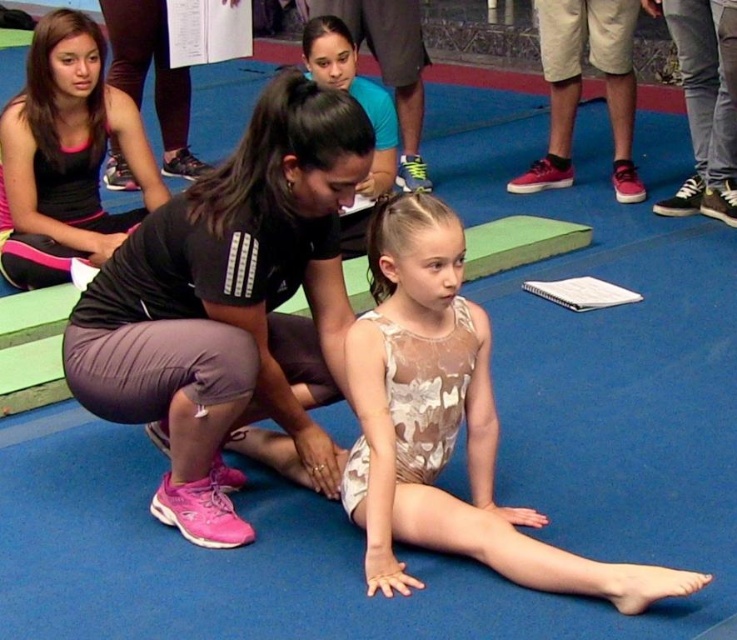
Which of these two, camouflage leotard at center or matte black tank top at upper left, stands taller?

Standing taller between the two is matte black tank top at upper left.

Is point (383, 531) less distant than point (29, 259)?

Yes, point (383, 531) is closer to viewer.

Image resolution: width=737 pixels, height=640 pixels. Find the location of `camouflage leotard at center`. camouflage leotard at center is located at coordinates (447, 426).

How much distance is there between matte black squat at center and camouflage leotard at center?

matte black squat at center and camouflage leotard at center are 13.97 inches apart.

At what (x,y) coordinates should I click in order to perform the action: click on matte black squat at center. Please return your answer as a coordinate pair (x, y). Looking at the image, I should click on (228, 305).

What do you see at coordinates (228, 305) in the screenshot? I see `matte black squat at center` at bounding box center [228, 305].

Where is `matte black squat at center`? Image resolution: width=737 pixels, height=640 pixels. matte black squat at center is located at coordinates (228, 305).

Which is above, matte black squat at center or matte black tank top at upper left?

matte black tank top at upper left

Identify the location of matte black squat at center. (228, 305).